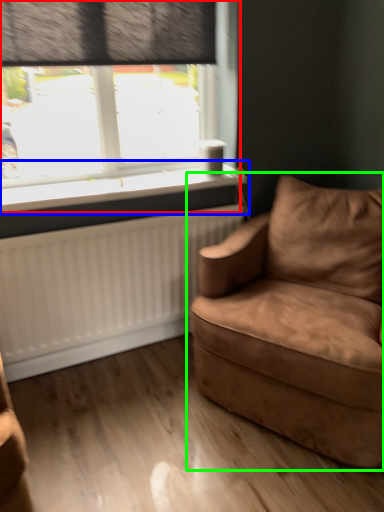
Question: Based on their relative distances, which object is farther from window (highlighted by a red box)? Choose from window sill (highlighted by a blue box) and studio couch (highlighted by a green box).

Choices:
 (A) window sill
 (B) studio couch

Answer: (B)